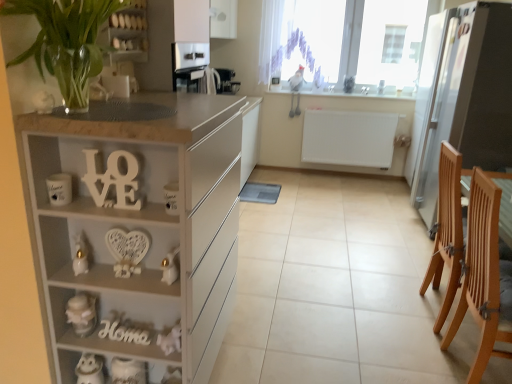
The height and width of the screenshot is (384, 512). What do you see at coordinates (114, 180) in the screenshot?
I see `white wood love sign at center, which appears as the 2th alphabet when viewed from the back` at bounding box center [114, 180].

Where is `white glossy rabbit at left, marked as the second toy in a left-to-right arrangement`? This screenshot has height=384, width=512. white glossy rabbit at left, marked as the second toy in a left-to-right arrangement is located at coordinates (80, 255).

What do you see at coordinates (123, 333) in the screenshot?
I see `wooden sign at lower center, placed as the first alphabet when sorted from bottom to top` at bounding box center [123, 333].

What do you see at coordinates (484, 277) in the screenshot? The height and width of the screenshot is (384, 512). I see `light brown wooden chair at right` at bounding box center [484, 277].

The image size is (512, 384). Identify the location of white wood love sign at center, which is the second alphabet in bottom-to-top order. (114, 180).

In the scene shown: From a real-world perspective, is white sheer curtain at upper center over wooden sign at lower center, which is the 2th alphabet from front to back?

Yes, from a real-world perspective, white sheer curtain at upper center is over wooden sign at lower center, which is the 2th alphabet from front to back

Is wooden sign at lower center, placed as the first alphabet when sorted from bottom to top, inside white sheer curtain at upper center?

No, wooden sign at lower center, placed as the first alphabet when sorted from bottom to top, is located outside of white sheer curtain at upper center.

Can you confirm if white sheer curtain at upper center is bigger than wooden sign at lower center, the 1th alphabet viewed from the back?

Indeed, white sheer curtain at upper center has a larger size compared to wooden sign at lower center, the 1th alphabet viewed from the back.

Is white sheer curtain at upper center to the right of wooden sign at lower center, the second alphabet when ordered from top to bottom, from the viewer's perspective?

Yes, white sheer curtain at upper center is to the right of wooden sign at lower center, the second alphabet when ordered from top to bottom.

Does satin silver refrigerator at right, arranged as the 3th appliance when ordered from the bottom, turn towards white matte jar at lower left, which appears as the 3th toy when viewed from the right?

No, satin silver refrigerator at right, arranged as the 3th appliance when ordered from the bottom, is not oriented towards white matte jar at lower left, which appears as the 3th toy when viewed from the right.

Is white matte jar at lower left, placed as the first toy when sorted from left to right, inside satin silver refrigerator at right, which is counted as the third appliance, starting from the front?

Definitely not — white matte jar at lower left, placed as the first toy when sorted from left to right, is not inside satin silver refrigerator at right, which is counted as the third appliance, starting from the front.

From the image's perspective, would you say satin silver refrigerator at right, arranged as the second appliance when viewed from the top, is positioned over white matte jar at lower left, placed as the first toy when sorted from left to right?

Yes, from the image's perspective, satin silver refrigerator at right, arranged as the second appliance when viewed from the top, is above white matte jar at lower left, placed as the first toy when sorted from left to right.

In terms of width, does white glossy candle at lower left, the first toy from the right, look wider or thinner when compared to white glossy rabbit at left, marked as the second toy in a left-to-right arrangement?

In the image, white glossy candle at lower left, the first toy from the right, appears to be wider than white glossy rabbit at left, marked as the second toy in a left-to-right arrangement.

This screenshot has height=384, width=512. I want to click on toy in front of the white glossy rabbit at left, marked as the second toy in a left-to-right arrangement, so click(170, 267).

Can you confirm if white glossy candle at lower left, placed as the 3th toy when sorted from left to right, is smaller than white glossy rabbit at left, marked as the 2th toy in a right-to-left arrangement?

No.

Considering the points (168, 267) and (81, 232), which point is in front, point (168, 267) or point (81, 232)?

Positioned in front is point (81, 232).

Considering the positions of objects white ceramic mug at left, which appears as the 2th appliance when viewed from the left, and satin black coffee machine at upper center, which is the 1th appliance in top-to-bottom order, in the image provided, who is in front, white ceramic mug at left, which appears as the 2th appliance when viewed from the left, or satin black coffee machine at upper center, which is the 1th appliance in top-to-bottom order,?

white ceramic mug at left, which appears as the 2th appliance when viewed from the left, is closer to the camera.

How much distance is there between white ceramic mug at left, which is counted as the second appliance, starting from the bottom, and satin black coffee machine at upper center, which is the 4th appliance from bottom to top?

They are 3.46 feet apart.

Are white ceramic mug at left, which is the 1th appliance in front-to-back order, and satin black coffee machine at upper center, which is the 1th appliance in top-to-bottom order, making contact?

No, white ceramic mug at left, which is the 1th appliance in front-to-back order, is not in contact with satin black coffee machine at upper center, which is the 1th appliance in top-to-bottom order.

Is white ceramic mug at left, marked as the 4th appliance in a back-to-front arrangement, situated inside satin black coffee machine at upper center, the 4th appliance in the front-to-back sequence, or outside?

white ceramic mug at left, marked as the 4th appliance in a back-to-front arrangement, is outside satin black coffee machine at upper center, the 4th appliance in the front-to-back sequence.

Consider the image. Which object is closer to the camera taking this photo, white wood love sign at center, which appears as the 2th alphabet when viewed from the back, or white sheer curtain at upper center?

white wood love sign at center, which appears as the 2th alphabet when viewed from the back.

From a real-world perspective, does white wood love sign at center, which is the second alphabet in bottom-to-top order, sit lower than white sheer curtain at upper center?

Yes, from a real-world perspective, white wood love sign at center, which is the second alphabet in bottom-to-top order, is beneath white sheer curtain at upper center.

Is white wood love sign at center, the 1th alphabet when ordered from front to back, at the right side of white sheer curtain at upper center?

Incorrect, white wood love sign at center, the 1th alphabet when ordered from front to back, is not on the right side of white sheer curtain at upper center.

How many degrees apart are the facing directions of light brown wooden chair at right and white sheer curtain at upper center?

The facing directions of light brown wooden chair at right and white sheer curtain at upper center are 90.1 degrees apart.

Who is smaller, light brown wooden chair at right or white sheer curtain at upper center?

With smaller size is white sheer curtain at upper center.

Considering the relative sizes of light brown wooden chair at right and white sheer curtain at upper center in the image provided, is light brown wooden chair at right shorter than white sheer curtain at upper center?

No, light brown wooden chair at right is not shorter than white sheer curtain at upper center.

Considering the positions of objects light brown wooden chair at right and white sheer curtain at upper center in the image provided, who is in front, light brown wooden chair at right or white sheer curtain at upper center?

Positioned in front is light brown wooden chair at right.

Based on the photo, is clear glass vase at upper left taller than white matte cabinet at left?

No.

Is white matte cabinet at left surrounded by clear glass vase at upper left?

No, clear glass vase at upper left does not contain white matte cabinet at left.

From the image's perspective, between clear glass vase at upper left and white matte cabinet at left, which one is located above?

clear glass vase at upper left, from the image's perspective.

Based on their positions, is clear glass vase at upper left located to the left or right of white matte cabinet at left?

In the image, clear glass vase at upper left appears on the left side of white matte cabinet at left.

Image resolution: width=512 pixels, height=384 pixels. Find the location of `window screen on the right of wooden sign at lower center, which is the 2th alphabet from front to back`. window screen on the right of wooden sign at lower center, which is the 2th alphabet from front to back is located at coordinates (312, 39).

At what (x,y) coordinates should I click in order to perform the action: click on toy that is the 1st object located in front of the satin silver refrigerator at right, arranged as the second appliance when viewed from the top. Please return your answer as a coordinate pair (x, y). Image resolution: width=512 pixels, height=384 pixels. Looking at the image, I should click on (82, 313).

Looking at the image, which one is located further to satin black coffee machine at upper center, which is the 4th appliance from bottom to top, white matte jar at lower left, which appears as the 3th toy when viewed from the right, or white ceramic mug at left, which is the 1th appliance in front-to-back order?

white matte jar at lower left, which appears as the 3th toy when viewed from the right, is further to satin black coffee machine at upper center, which is the 4th appliance from bottom to top.

Considering their positions, is white glossy rabbit at left, marked as the 2th toy in a right-to-left arrangement, positioned further to white wood love sign at center, the 1th alphabet when ordered from front to back, than satin silver refrigerator at right, the fourth appliance viewed from the left?

satin silver refrigerator at right, the fourth appliance viewed from the left.

Estimate the real-world distances between objects in this image. Which object is closer to satin silver refrigerator at right, the fourth appliance viewed from the left, white sheer curtain at upper center or satin black coffee machine at upper center, which is the 1th appliance in top-to-bottom order?

white sheer curtain at upper center is positioned closer to the anchor satin silver refrigerator at right, the fourth appliance viewed from the left.

Which object lies nearer to the anchor point white ceramic owl at lower left, marked as the 3th appliance in a back-to-front arrangement, clear glass vase at upper left or white wood love sign at center, which is the second alphabet in bottom-to-top order?

Based on the image, white wood love sign at center, which is the second alphabet in bottom-to-top order, appears to be nearer to white ceramic owl at lower left, marked as the 3th appliance in a back-to-front arrangement.

Based on their spatial positions, is wooden sign at lower center, which is the 2th alphabet from front to back, or white glossy cabinet at upper center closer to satin silver refrigerator at right, arranged as the 3th appliance when ordered from the bottom?

white glossy cabinet at upper center is closer to satin silver refrigerator at right, arranged as the 3th appliance when ordered from the bottom.

Considering their positions, is transparent glass window at upper center positioned closer to white glossy rabbit at left, marked as the second toy in a left-to-right arrangement, than light brown wooden chair at right?

light brown wooden chair at right lies closer to white glossy rabbit at left, marked as the second toy in a left-to-right arrangement, than the other object.

Looking at the image, which one is located closer to wooden sign at lower center, the 1th alphabet viewed from the back, white matte jar at lower left, which appears as the 3th toy when viewed from the right, or white ceramic mug at left, which is counted as the second appliance, starting from the bottom?

Among the two, white matte jar at lower left, which appears as the 3th toy when viewed from the right, is located nearer to wooden sign at lower center, the 1th alphabet viewed from the back.

From the picture: Which object lies nearer to the anchor point white glossy cabinet at upper center, white matte jar at lower left, which appears as the 3th toy when viewed from the right, or satin silver refrigerator at right, arranged as the 3th appliance when ordered from the bottom?

The object closer to white glossy cabinet at upper center is white matte jar at lower left, which appears as the 3th toy when viewed from the right.

I want to click on plant between white ceramic owl at lower left, the first appliance viewed from the left, and satin silver refrigerator at right, which is counted as the third appliance, starting from the front, in the horizontal direction, so click(x=66, y=42).

You are a GUI agent. You are given a task and a screenshot of the screen. Output one action in this format:
    pyautogui.click(x=<x>, y=<y>)
    Task: Click on the plant situated between white matte jar at lower left, placed as the first toy when sorted from left to right, and light brown wooden chair at right from left to right
    This screenshot has width=512, height=384.
    Given the screenshot: What is the action you would take?
    66,42

You are a GUI agent. You are given a task and a screenshot of the screen. Output one action in this format:
    pyautogui.click(x=<x>, y=<y>)
    Task: Click on the appliance between white ceramic owl at lower left, the 1th appliance in the bottom-to-top sequence, and white sheer curtain at upper center in the front-back direction
    
    Given the screenshot: What is the action you would take?
    pyautogui.click(x=470, y=97)

You are a GUI agent. You are given a task and a screenshot of the screen. Output one action in this format:
    pyautogui.click(x=<x>, y=<y>)
    Task: Click on the window located between white matte jar at lower left, placed as the first toy when sorted from left to right, and satin black coffee machine at upper center, the third appliance when ordered from left to right, in the depth direction
    This screenshot has height=384, width=512.
    Given the screenshot: What is the action you would take?
    [x=302, y=40]